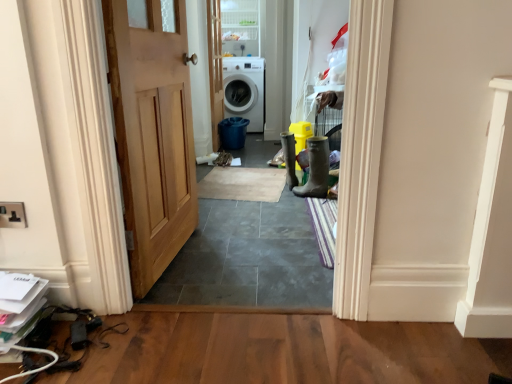
Locate an element on the screen. This screenshot has width=512, height=384. empty space that is to the right of natural wood door at center, acting as the first door starting from the front is located at coordinates (248, 254).